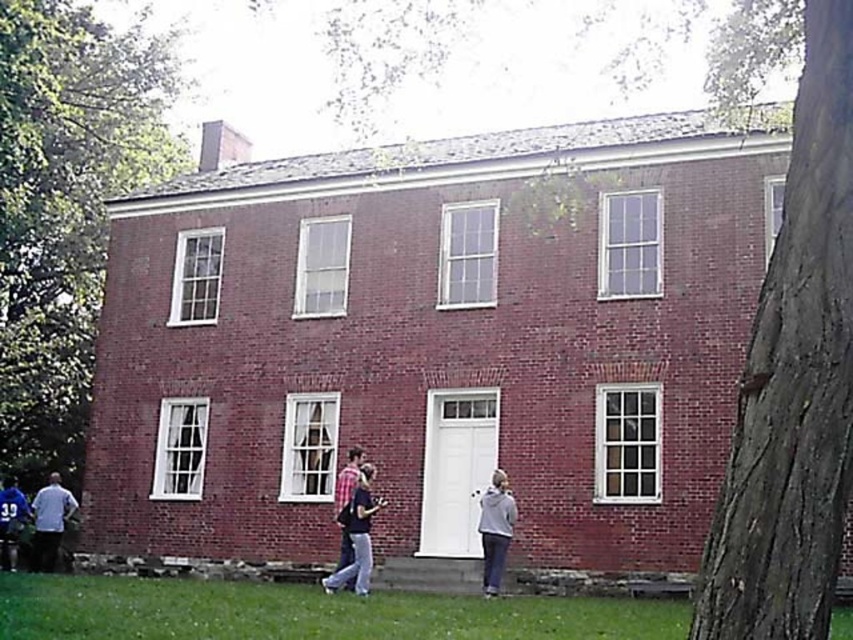
Question: Does matte pink shirt at center have a lesser width compared to light blue shirt at lower left?

Choices:
 (A) yes
 (B) no

Answer: (A)

Question: Among these objects, which one is farthest from the camera?

Choices:
 (A) blue fabric shirt at lower left
 (B) brown rough bark tree at right

Answer: (A)

Question: Is green leafy tree at lower left behind gray fleece jacket at lower right?

Choices:
 (A) yes
 (B) no

Answer: (A)

Question: Which object is closer to the camera taking this photo?

Choices:
 (A) green leafy tree at lower left
 (B) gray fleece jacket at lower right
 (C) light blue shirt at lower left

Answer: (B)

Question: Does green grass at lower center have a greater width compared to blue fabric shirt at lower left?

Choices:
 (A) yes
 (B) no

Answer: (A)

Question: Which object is positioned farthest from the green grass at lower center?

Choices:
 (A) matte pink shirt at center
 (B) green leafy tree at lower left
 (C) blue fabric shirt at lower left
 (D) gray fleece jacket at lower right

Answer: (B)